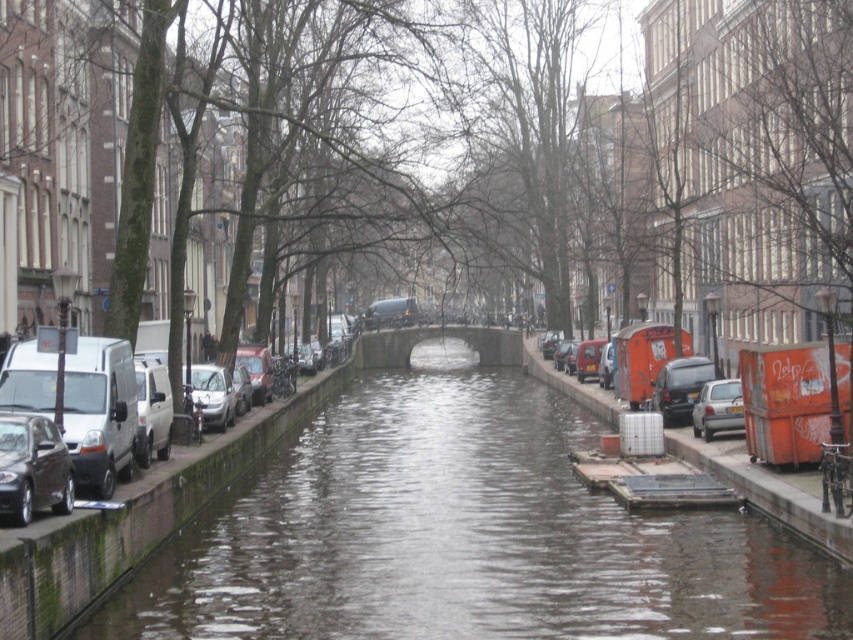
Which is below, shiny black car at left or silver metallic car at center-left?

silver metallic car at center-left is below.

Does shiny black car at left appear under silver metallic car at center-left?

No.

Who is more forward, [36,448] or [213,396]?

Positioned in front is point [36,448].

Locate an element on the screen. The height and width of the screenshot is (640, 853). shiny black car at left is located at coordinates (32, 467).

Who is higher up, smooth concrete canal at center or silver metallic car at center?

Positioned higher is silver metallic car at center.

Between point (601, 509) and point (735, 408), which one is positioned in front?

Positioned in front is point (601, 509).

Who is more forward, (637, 600) or (714, 396)?

Point (637, 600)

At what (x,y) coordinates should I click in order to perform the action: click on smooth concrete canal at center. Please return your answer as a coordinate pair (x, y). This screenshot has height=640, width=853. Looking at the image, I should click on (462, 534).

Which is below, matte black van at center or silver metallic car at center-left?

Positioned lower is silver metallic car at center-left.

Between point (682, 417) and point (207, 401), which one is positioned behind?

Positioned behind is point (682, 417).

Between point (668, 392) and point (216, 417), which one is positioned behind?

Point (668, 392)

I want to click on matte black van at center, so click(x=680, y=387).